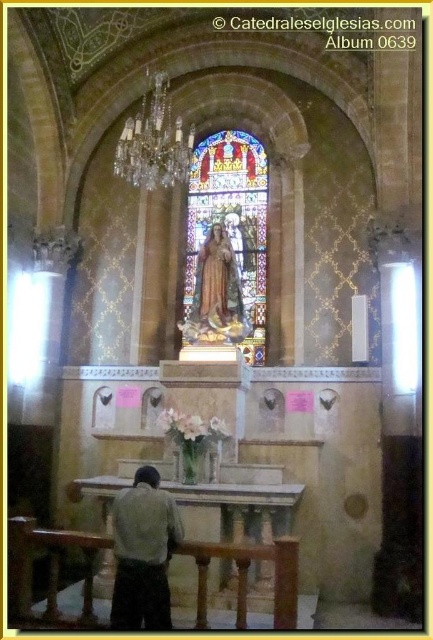
Does light brown leather jacket at lower left have a greater height compared to matte gold statue at center?

No.

Is light brown leather jacket at lower left closer to camera compared to matte gold statue at center?

Yes.

Is point (135, 522) closer to camera compared to point (203, 260)?

Yes.

Locate an element on the screen. Image resolution: width=433 pixels, height=640 pixels. light brown leather jacket at lower left is located at coordinates (142, 552).

Does crystal glass chandelier at upper left have a smaller size compared to matte gold statue at center?

Incorrect, crystal glass chandelier at upper left is not smaller in size than matte gold statue at center.

Does point (164, 154) lie in front of point (229, 298)?

No.

Is point (135, 136) positioned behind point (235, 316)?

Yes, point (135, 136) is farther from viewer.

Identify the location of crystal glass chandelier at upper left. Image resolution: width=433 pixels, height=640 pixels. (155, 141).

Does stained glass window at center come behind light brown leather jacket at lower left?

That is True.

Is point (223, 234) farther from viewer compared to point (135, 561)?

Yes, point (223, 234) is behind point (135, 561).

Is point (210, 269) positioned in front of point (145, 596)?

No, (210, 269) is behind (145, 596).

Where is `stained glass window at center`? The image size is (433, 640). stained glass window at center is located at coordinates (226, 244).